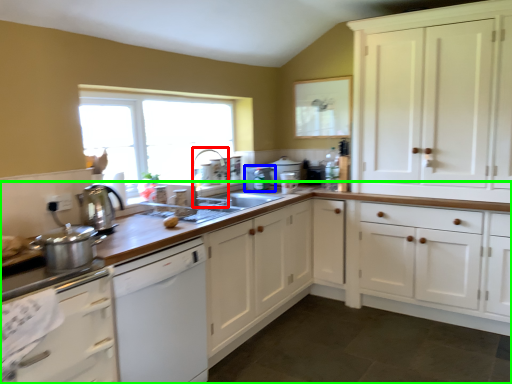
Question: Which is farther away from faucet (highlighted by a red box)? appliance (highlighted by a blue box) or countertop (highlighted by a green box)?

Choices:
 (A) appliance
 (B) countertop

Answer: (B)